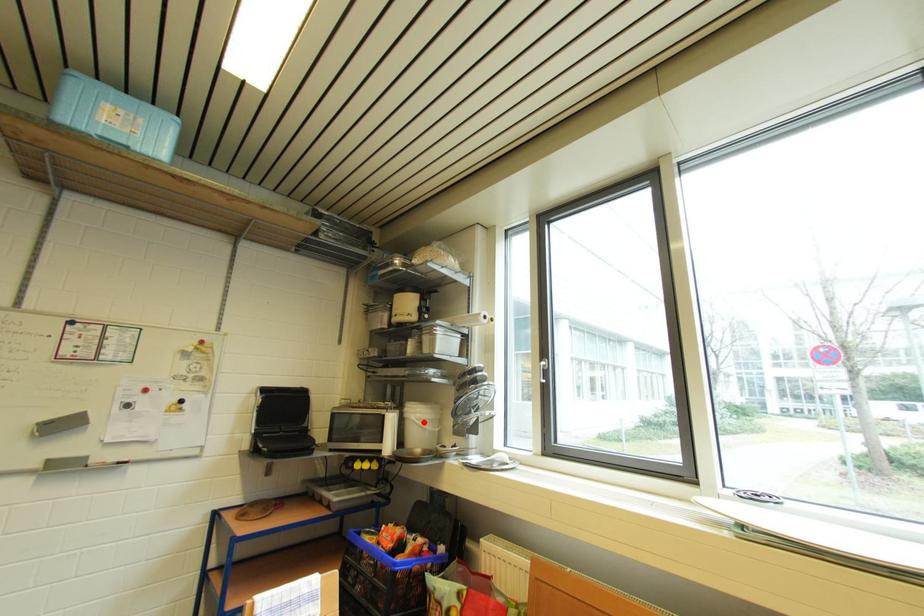
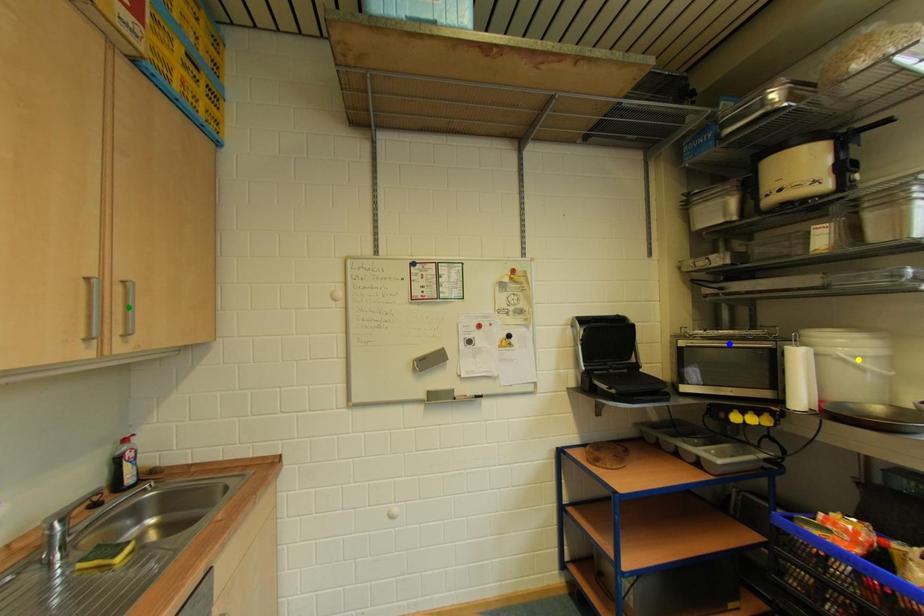
Question: I am providing you with two images of the same scene from different viewpoints. A red point is marked on the first image. You are given multiple points on the second image. Which mark in image 2 goes with the point in image 1?

Choices:
 (A) yellow point
 (B) blue point
 (C) green point

Answer: (A)